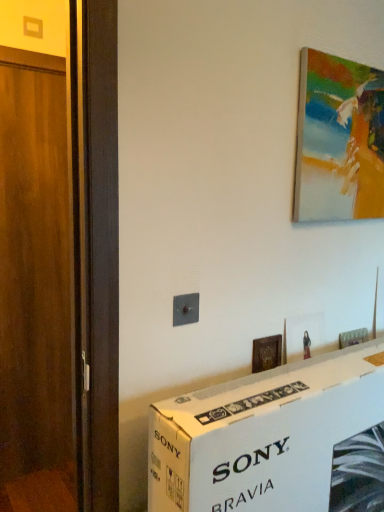
Locate an element on the screen. free spot above white cardboard box at lower center (from a real-world perspective) is located at coordinates (303, 379).